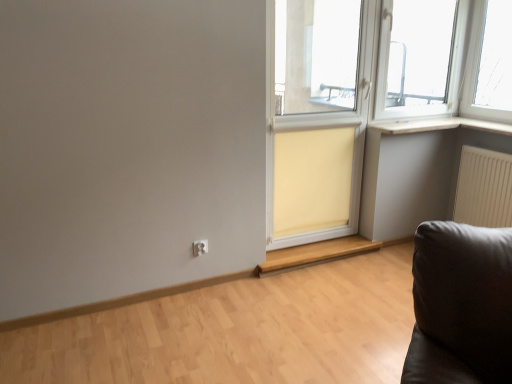
What do you see at coordinates (317, 117) in the screenshot? I see `beige fabric screen door at center` at bounding box center [317, 117].

Image resolution: width=512 pixels, height=384 pixels. What do you see at coordinates (315, 253) in the screenshot?
I see `matte wood window sill at lower center` at bounding box center [315, 253].

What is the approximate height of matte wood window sill at lower center?

matte wood window sill at lower center is 4.05 inches in height.

What is the approximate width of beige fabric curtain at center?

beige fabric curtain at center is 3.82 inches in width.

The image size is (512, 384). In order to click on white matte wood at upper right in this screenshot , I will do `click(439, 125)`.

Based on their sizes in the image, would you say matte wood window sill at lower center is bigger or smaller than white plastic electric outlet at lower center?

In the image, matte wood window sill at lower center appears to be larger than white plastic electric outlet at lower center.

Is matte wood window sill at lower center with white plastic electric outlet at lower center?

No, matte wood window sill at lower center is not making contact with white plastic electric outlet at lower center.

Does point (373, 245) lie behind point (199, 250)?

Yes.

Could you tell me if matte wood window sill at lower center is facing white plastic electric outlet at lower center?

No, matte wood window sill at lower center is not aimed at white plastic electric outlet at lower center.

Considering the sizes of objects white matte wood at upper right and beige fabric screen door at center in the image provided, who is smaller, white matte wood at upper right or beige fabric screen door at center?

white matte wood at upper right.

Based on the photo, would you consider white matte wood at upper right to be distant from beige fabric screen door at center?

No, white matte wood at upper right is in close proximity to beige fabric screen door at center.

Considering the points (437, 126) and (286, 0), which point is in front, point (437, 126) or point (286, 0)?

Point (286, 0)

From the image's perspective, which is above, white matte wood at upper right or beige fabric screen door at center?

white matte wood at upper right, from the image's perspective.

Is beige fabric curtain at center facing away from matte wood window sill at lower center?

No, beige fabric curtain at center is not facing the opposite direction of matte wood window sill at lower center.

In the scene shown: Can you confirm if beige fabric curtain at center is bigger than matte wood window sill at lower center?

Yes.

Is point (327, 179) farther from camera compared to point (359, 248)?

No.

Consider the image. Between beige fabric screen door at center and white plastic electric outlet at lower center, which one has larger size?

Bigger between the two is beige fabric screen door at center.

In terms of width, does beige fabric screen door at center look wider or thinner when compared to white plastic electric outlet at lower center?

Considering their sizes, beige fabric screen door at center looks broader than white plastic electric outlet at lower center.

You are a GUI agent. You are given a task and a screenshot of the screen. Output one action in this format:
    pyautogui.click(x=<x>, y=<y>)
    Task: Click on the electric outlet on the left of beige fabric screen door at center
    The image size is (512, 384).
    Given the screenshot: What is the action you would take?
    pyautogui.click(x=200, y=247)

Is beige fabric screen door at center behind white plastic electric outlet at lower center?

No, the depth of beige fabric screen door at center is less than that of white plastic electric outlet at lower center.

From the image's perspective, is beige fabric curtain at center below white plastic electric outlet at lower center?

No.

From a real-world perspective, relative to white plastic electric outlet at lower center, is beige fabric curtain at center vertically above or below?

beige fabric curtain at center is situated higher than white plastic electric outlet at lower center in the real world.

How many degrees apart are the facing directions of beige fabric curtain at center and white plastic electric outlet at lower center?

The angular difference between beige fabric curtain at center and white plastic electric outlet at lower center is 0.481 degrees.

Would you consider beige fabric curtain at center to be distant from white plastic electric outlet at lower center?

No.

Can you see white plastic electric outlet at lower center touching beige fabric curtain at center?

No, white plastic electric outlet at lower center is not next to beige fabric curtain at center.

Could you tell me if white plastic electric outlet at lower center is facing beige fabric curtain at center?

No, white plastic electric outlet at lower center does not turn towards beige fabric curtain at center.

Between white plastic electric outlet at lower center and beige fabric curtain at center, which one has smaller size?

With smaller size is white plastic electric outlet at lower center.

Between white matte wood at upper right and white plastic electric outlet at lower center, which one appears on the right side from the viewer's perspective?

white matte wood at upper right is more to the right.

Is white matte wood at upper right in contact with white plastic electric outlet at lower center?

No.

Does white matte wood at upper right turn towards white plastic electric outlet at lower center?

No, white matte wood at upper right is not turned towards white plastic electric outlet at lower center.

Where is `window that appears below the white plastic electric outlet at lower center (from a real-world perspective)`? The width and height of the screenshot is (512, 384). window that appears below the white plastic electric outlet at lower center (from a real-world perspective) is located at coordinates (315, 253).

Image resolution: width=512 pixels, height=384 pixels. I want to click on screen door below the white matte wood at upper right (from the image's perspective), so click(x=317, y=117).

Looking at the image, which one is located closer to beige fabric screen door at center, matte wood window sill at lower center or white plastic electric outlet at lower center?

matte wood window sill at lower center is positioned closer to the anchor beige fabric screen door at center.

Based on their spatial positions, is white plastic electric outlet at lower center or white matte wood at upper right further from matte wood window sill at lower center?

white matte wood at upper right lies further to matte wood window sill at lower center than the other object.

Looking at the image, which one is located further to white plastic electric outlet at lower center, beige fabric screen door at center or beige fabric curtain at center?

beige fabric screen door at center lies further to white plastic electric outlet at lower center than the other object.

When comparing their distances from white matte wood at upper right, does matte wood window sill at lower center or beige fabric curtain at center seem further?

Based on the image, matte wood window sill at lower center appears to be further to white matte wood at upper right.

From the image, which object appears to be farther from beige fabric screen door at center, white plastic electric outlet at lower center or white matte wood at upper right?

white plastic electric outlet at lower center.

Which object lies nearer to the anchor point beige fabric screen door at center, white plastic electric outlet at lower center or beige fabric curtain at center?

beige fabric curtain at center is closer to beige fabric screen door at center.

Which object lies further to the anchor point matte wood window sill at lower center, white plastic electric outlet at lower center or beige fabric curtain at center?

The object further to matte wood window sill at lower center is white plastic electric outlet at lower center.

Estimate the real-world distances between objects in this image. Which object is closer to white matte wood at upper right, beige fabric screen door at center or white plastic electric outlet at lower center?

Based on the image, beige fabric screen door at center appears to be nearer to white matte wood at upper right.

I want to click on electric outlet between beige fabric screen door at center and matte wood window sill at lower center in the vertical direction, so click(200, 247).

Where is `window between white plastic electric outlet at lower center and white matte wood at upper right`? The height and width of the screenshot is (384, 512). window between white plastic electric outlet at lower center and white matte wood at upper right is located at coordinates (315, 253).

Where is `screen door between white matte wood at upper right and matte wood window sill at lower center vertically`? Image resolution: width=512 pixels, height=384 pixels. screen door between white matte wood at upper right and matte wood window sill at lower center vertically is located at coordinates (317, 117).

Where is `screen door situated between white plastic electric outlet at lower center and white matte wood at upper right from left to right`? The width and height of the screenshot is (512, 384). screen door situated between white plastic electric outlet at lower center and white matte wood at upper right from left to right is located at coordinates (317, 117).